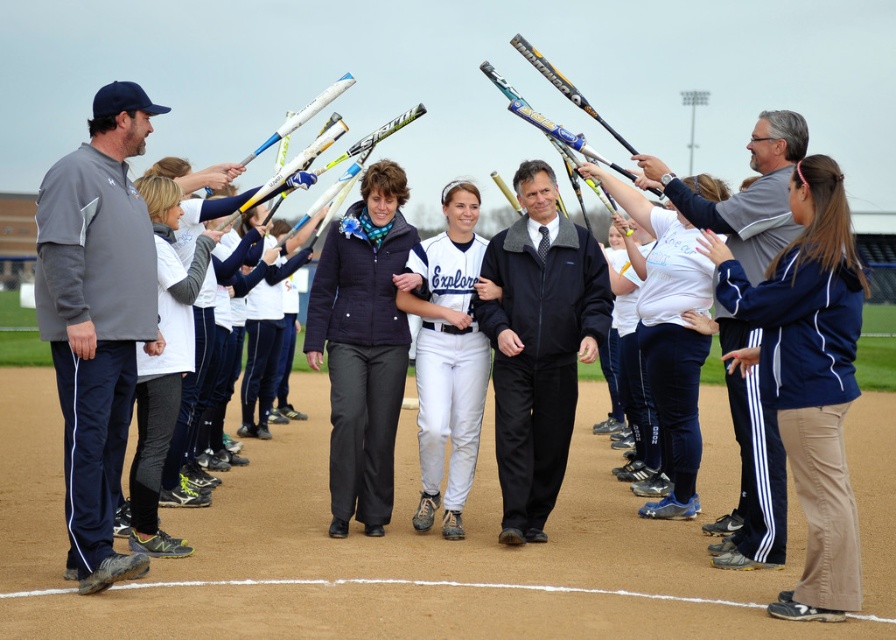
Which is more to the left, blue track pants at center or white matte uniform at center?

From the viewer's perspective, white matte uniform at center appears more on the left side.

From the picture: Is blue track pants at center to the left of white matte uniform at center from the viewer's perspective?

In fact, blue track pants at center is to the right of white matte uniform at center.

Identify the location of blue track pants at center. (808, 376).